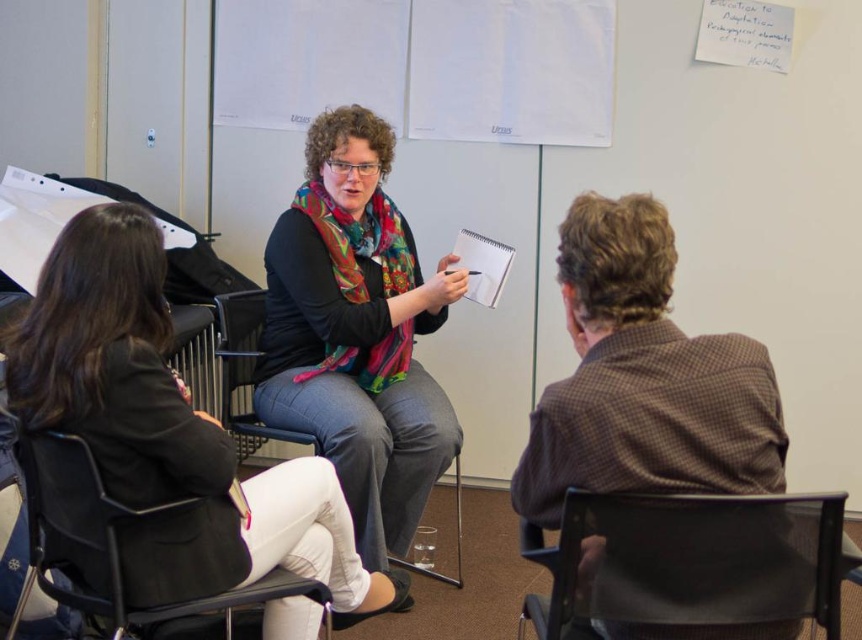
Who is lower down, multicolored scarf at center or black mesh chair at lower left?

black mesh chair at lower left is lower down.

Can you confirm if multicolored scarf at center is shorter than black mesh chair at lower left?

No.

You are a GUI agent. You are given a task and a screenshot of the screen. Output one action in this format:
    pyautogui.click(x=<x>, y=<y>)
    Task: Click on the multicolored scarf at center
    The height and width of the screenshot is (640, 862).
    Given the screenshot: What is the action you would take?
    pyautogui.click(x=167, y=432)

Is multicolored scarf at center smaller than black matte scarf at center?

Incorrect, multicolored scarf at center is not smaller in size than black matte scarf at center.

Which is more to the left, multicolored scarf at center or black matte scarf at center?

multicolored scarf at center is more to the left.

Is point (139, 248) in front of point (298, 360)?

That is True.

This screenshot has height=640, width=862. What are the coordinates of `multicolored scarf at center` in the screenshot? It's located at (167, 432).

Who is more forward, (32, 461) or (259, 305)?

Positioned in front is point (32, 461).

Does point (127, 513) come closer to viewer compared to point (248, 440)?

Yes, it is.

Which is in front, point (69, 490) or point (244, 321)?

Point (69, 490) is more forward.

In order to click on black mesh chair at lower left in this screenshot , I will do `click(67, 532)`.